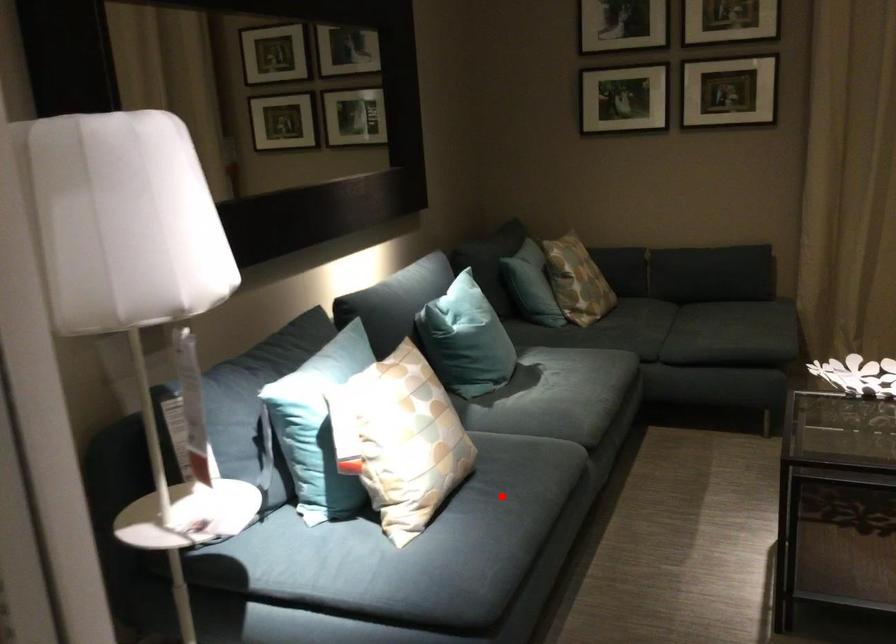
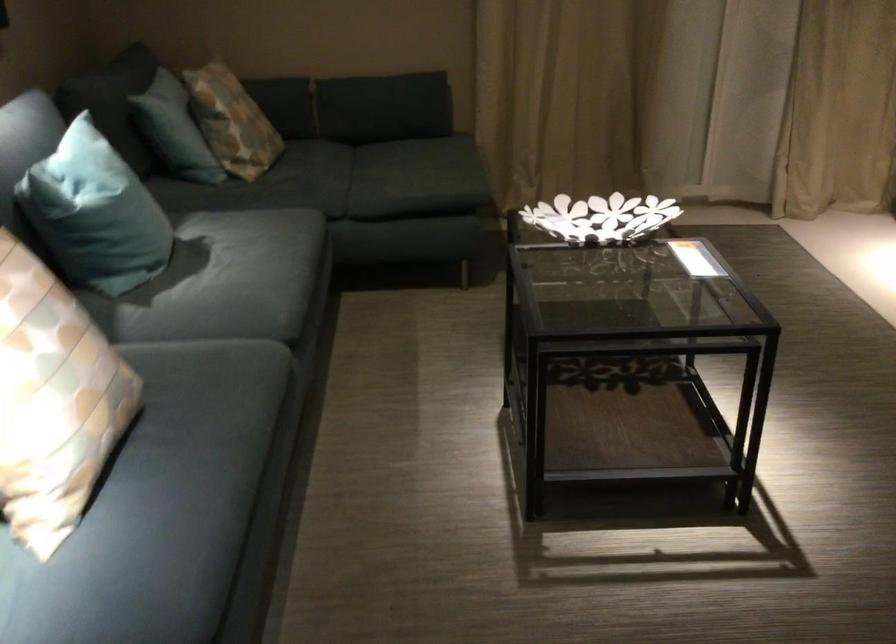
Find the pixel in the second image that matches the highlighted location in the first image.

(197, 436)